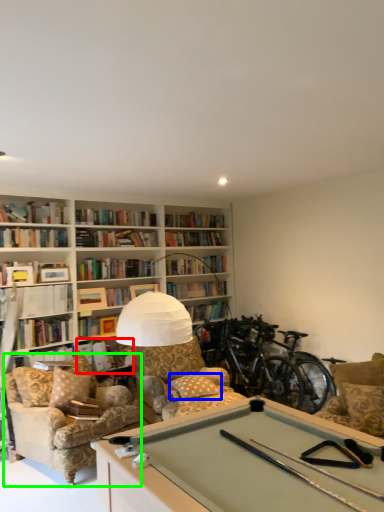
Question: Considering the real-world distances, which object is closest to book (highlighted by a red box)? pillow (highlighted by a blue box) or chair (highlighted by a green box).

Choices:
 (A) pillow
 (B) chair

Answer: (B)